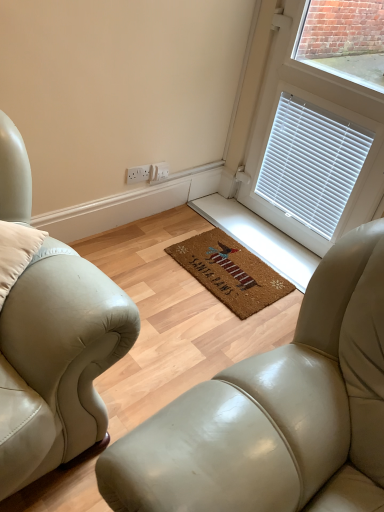
Based on the photo, measure the distance between white plastic electrical outlet at center and camera.

white plastic electrical outlet at center is 2.15 meters away from camera.

I want to click on white plastic electrical outlet at center, so click(138, 174).

The height and width of the screenshot is (512, 384). In order to click on brown coir mat at center in this screenshot , I will do `click(230, 272)`.

Where is `white plastic electrical outlet at center`? white plastic electrical outlet at center is located at coordinates (138, 174).

Can you confirm if white blinds at upper right is shorter than brown coir mat at center?

In fact, white blinds at upper right may be taller than brown coir mat at center.

Considering the positions of objects white blinds at upper right and brown coir mat at center in the image provided, who is more to the left, white blinds at upper right or brown coir mat at center?

brown coir mat at center is more to the left.

Who is smaller, white blinds at upper right or brown coir mat at center?

brown coir mat at center is smaller.

Can you see brown coir mat at center touching leather studio couch at center?

No.

Does point (263, 275) appear closer or farther from the camera than point (274, 353)?

Clearly, point (263, 275) is more distant from the camera than point (274, 353).

Is white blinds at upper right surrounding white plastic electrical outlet at center?

Actually, white plastic electrical outlet at center is outside white blinds at upper right.

From the picture: Which is more to the right, white blinds at upper right or white plastic electrical outlet at center?

A: Positioned to the right is white blinds at upper right.

How different are the orientations of white blinds at upper right and white plastic electrical outlet at center in degrees?

The angle between the facing direction of white blinds at upper right and the facing direction of white plastic electrical outlet at center is 90 degrees.

Which of these two, white blinds at upper right or white plastic electrical outlet at center, is wider?

white blinds at upper right.

Does point (268, 440) lie in front of point (312, 234)?

Yes, point (268, 440) is closer to viewer.

Which of these two, leather studio couch at center or white blinds at upper right, is bigger?

leather studio couch at center is bigger.

How much distance is there between leather studio couch at center and white blinds at upper right?

leather studio couch at center is 39.34 inches away from white blinds at upper right.

Considering the sizes of objects white plastic electrical outlet at center and brown coir mat at center in the image provided, who is thinner, white plastic electrical outlet at center or brown coir mat at center?

Thinner between the two is white plastic electrical outlet at center.

Considering the relative positions of white plastic electrical outlet at center and brown coir mat at center in the image provided, is white plastic electrical outlet at center to the right of brown coir mat at center from the viewer's perspective?

Incorrect, white plastic electrical outlet at center is not on the right side of brown coir mat at center.

From a real-world perspective, relative to brown coir mat at center, is white plastic electrical outlet at center vertically above or below?

Clearly, from a real-world perspective, white plastic electrical outlet at center is above brown coir mat at center.

Is white plastic electrical outlet at center inside or outside of brown coir mat at center?

The correct answer is: outside.

Considering the relative positions of leather studio couch at center and white plastic electrical outlet at center in the image provided, is leather studio couch at center to the right of white plastic electrical outlet at center from the viewer's perspective?

Yes.

Based on the photo, which object is further away from the camera taking this photo, leather studio couch at center or white plastic electrical outlet at center?

white plastic electrical outlet at center is further away from the camera.

From a real-world perspective, who is located lower, leather studio couch at center or white plastic electrical outlet at center?

In real-world perspective, leather studio couch at center is lower.

From a real-world perspective, between brown coir mat at center and white blinds at upper right, who is vertically lower?

brown coir mat at center, from a real-world perspective.

From the picture: Is brown coir mat at center smaller than white blinds at upper right?

Indeed, brown coir mat at center has a smaller size compared to white blinds at upper right.

Can you confirm if brown coir mat at center is thinner than white blinds at upper right?

No.

Looking at this image, from the image's perspective, is brown coir mat at center over white blinds at upper right?

Incorrect, from the image's perspective, brown coir mat at center is lower than white blinds at upper right.

At what (x,y) coordinates should I click in order to perform the action: click on mat below the white blinds at upper right (from a real-world perspective). Please return your answer as a coordinate pair (x, y). Looking at the image, I should click on (230, 272).

The image size is (384, 512). What are the coordinates of `studio couch on the left of brown coir mat at center` in the screenshot? It's located at (275, 410).

When comparing their distances from brown coir mat at center, does white plastic electrical outlet at center or white blinds at upper right seem closer?

Based on the image, white blinds at upper right appears to be nearer to brown coir mat at center.

When comparing their distances from white blinds at upper right, does leather studio couch at center or brown coir mat at center seem further?

leather studio couch at center is positioned further to the anchor white blinds at upper right.

From the image, which object appears to be farther from leather studio couch at center, brown coir mat at center or white plastic electrical outlet at center?

The object further to leather studio couch at center is white plastic electrical outlet at center.

Based on their spatial positions, is brown coir mat at center or leather studio couch at center further from white plastic electrical outlet at center?

Among the two, leather studio couch at center is located further to white plastic electrical outlet at center.

Based on their spatial positions, is leather studio couch at center or brown coir mat at center further from white plastic electrical outlet at center?

Among the two, leather studio couch at center is located further to white plastic electrical outlet at center.

Considering their positions, is leather studio couch at center positioned further to white plastic electrical outlet at center than white blinds at upper right?

leather studio couch at center.

Looking at the image, which one is located further to leather studio couch at center, white plastic electrical outlet at center or brown coir mat at center?

Among the two, white plastic electrical outlet at center is located further to leather studio couch at center.

Estimate the real-world distances between objects in this image. Which object is closer to leather studio couch at center, white blinds at upper right or brown coir mat at center?

The object closer to leather studio couch at center is white blinds at upper right.

The width and height of the screenshot is (384, 512). Find the location of `mat between white plastic electrical outlet at center and white blinds at upper right`. mat between white plastic electrical outlet at center and white blinds at upper right is located at coordinates (230, 272).

You are a GUI agent. You are given a task and a screenshot of the screen. Output one action in this format:
    pyautogui.click(x=<x>, y=<y>)
    Task: Click on the mat positioned between leather studio couch at center and white plastic electrical outlet at center from near to far
    
    Given the screenshot: What is the action you would take?
    pyautogui.click(x=230, y=272)

The height and width of the screenshot is (512, 384). In order to click on window between leather studio couch at center and white plastic electrical outlet at center from front to back in this screenshot , I will do `click(317, 111)`.

The image size is (384, 512). What are the coordinates of `window between leather studio couch at center and brown coir mat at center in the front-back direction` in the screenshot? It's located at (317, 111).